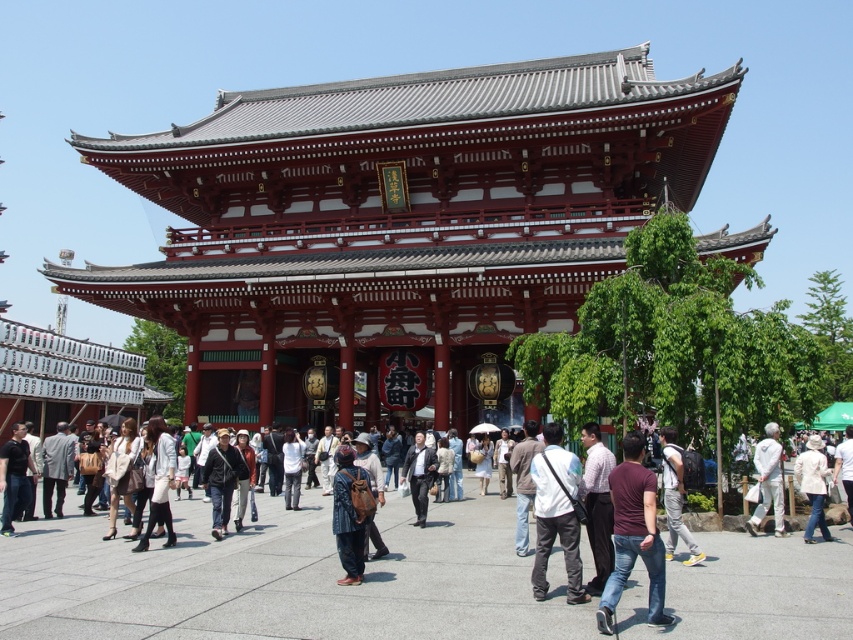
Can you confirm if dark maroon shirt at center is positioned above light beige fabric jacket at center?

Correct, dark maroon shirt at center is located above light beige fabric jacket at center.

Who is positioned more to the left, dark maroon shirt at center or light beige fabric jacket at center?

dark maroon shirt at center

Measure the distance between dark maroon shirt at center and camera.

The distance of dark maroon shirt at center from camera is 21.67 meters.

Identify the location of dark maroon shirt at center. (633, 534).

Does white matte shirt at center have a lesser width compared to dark gray suit at center?

Yes, white matte shirt at center is thinner than dark gray suit at center.

Is white matte shirt at center bigger than dark gray suit at center?

Incorrect, white matte shirt at center is not larger than dark gray suit at center.

Is point (540, 481) behind point (408, 449)?

No, (540, 481) is in front of (408, 449).

This screenshot has width=853, height=640. In order to click on white matte shirt at center in this screenshot , I will do `click(556, 515)`.

Between brown leather backpack at center and white cotton shirt at lower right, which one is positioned lower?

white cotton shirt at lower right is below.

Does brown leather backpack at center appear over white cotton shirt at lower right?

Correct, brown leather backpack at center is located above white cotton shirt at lower right.

Does point (363, 474) come in front of point (766, 432)?

Yes, it is.

Where is `brown leather backpack at center`? The image size is (853, 640). brown leather backpack at center is located at coordinates (350, 513).